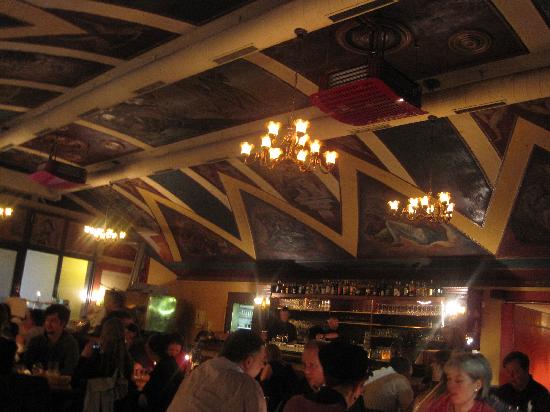
At what (x,y) coordinates should I click in order to perform the action: click on ceiling. Please return your answer as a coordinate pair (x, y). Looking at the image, I should click on (234, 106).